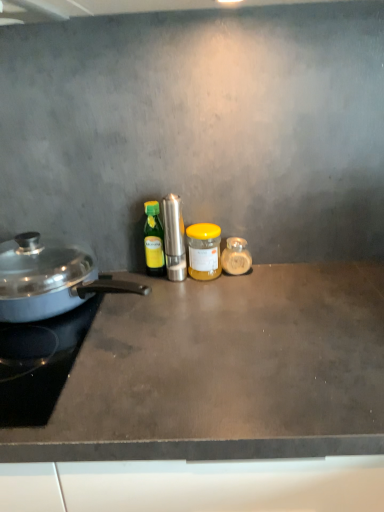
Question: Which direction should I rotate to look at polished stainless steel grinder at center, which ranks as the 3th kitchen appliance in right-to-left order, — up or down?

Choices:
 (A) up
 (B) down

Answer: (A)

Question: From a real-world perspective, is green glass bottle at center, positioned as the 4th kitchen appliance in right-to-left order, physically below polished stainless steel grinder at center, the third kitchen appliance when ordered from left to right?

Choices:
 (A) yes
 (B) no

Answer: (A)

Question: Is green glass bottle at center, marked as the second kitchen appliance in a left-to-right arrangement, further to camera compared to polished stainless steel grinder at center, the third kitchen appliance when ordered from left to right?

Choices:
 (A) yes
 (B) no

Answer: (A)

Question: Can you confirm if green glass bottle at center, positioned as the 4th kitchen appliance in right-to-left order, is bigger than polished stainless steel grinder at center, which ranks as the 3th kitchen appliance in right-to-left order?

Choices:
 (A) no
 (B) yes

Answer: (A)

Question: Is green glass bottle at center, positioned as the 4th kitchen appliance in right-to-left order, positioned with its back to polished stainless steel grinder at center, the third kitchen appliance when ordered from left to right?

Choices:
 (A) yes
 (B) no

Answer: (B)

Question: From the image's perspective, is green glass bottle at center, marked as the second kitchen appliance in a left-to-right arrangement, over polished stainless steel grinder at center, which ranks as the 3th kitchen appliance in right-to-left order?

Choices:
 (A) yes
 (B) no

Answer: (A)

Question: From a real-world perspective, is green glass bottle at center, positioned as the 4th kitchen appliance in right-to-left order, physically above polished stainless steel grinder at center, which ranks as the 3th kitchen appliance in right-to-left order?

Choices:
 (A) yes
 (B) no

Answer: (B)

Question: Can you confirm if shiny silver pan at left, placed as the 1th kitchen appliance when sorted from left to right, is shorter than green glass bottle at center, positioned as the 4th kitchen appliance in right-to-left order?

Choices:
 (A) yes
 (B) no

Answer: (A)

Question: Is the depth of shiny silver pan at left, placed as the 1th kitchen appliance when sorted from left to right, less than that of green glass bottle at center, marked as the second kitchen appliance in a left-to-right arrangement?

Choices:
 (A) no
 (B) yes

Answer: (B)

Question: Is shiny silver pan at left, placed as the 1th kitchen appliance when sorted from left to right, at the left side of green glass bottle at center, marked as the second kitchen appliance in a left-to-right arrangement?

Choices:
 (A) yes
 (B) no

Answer: (A)

Question: Is shiny silver pan at left, acting as the fifth kitchen appliance starting from the right, smaller than green glass bottle at center, positioned as the 4th kitchen appliance in right-to-left order?

Choices:
 (A) no
 (B) yes

Answer: (A)

Question: From the image's perspective, is shiny silver pan at left, acting as the fifth kitchen appliance starting from the right, under green glass bottle at center, marked as the second kitchen appliance in a left-to-right arrangement?

Choices:
 (A) yes
 (B) no

Answer: (A)

Question: From a real-world perspective, is shiny silver pan at left, acting as the fifth kitchen appliance starting from the right, on green glass bottle at center, marked as the second kitchen appliance in a left-to-right arrangement?

Choices:
 (A) yes
 (B) no

Answer: (B)

Question: Is yellow matte jar at center, the fourth kitchen appliance viewed from the left, not close to polished stainless steel grinder at center, which ranks as the 3th kitchen appliance in right-to-left order?

Choices:
 (A) no
 (B) yes

Answer: (A)